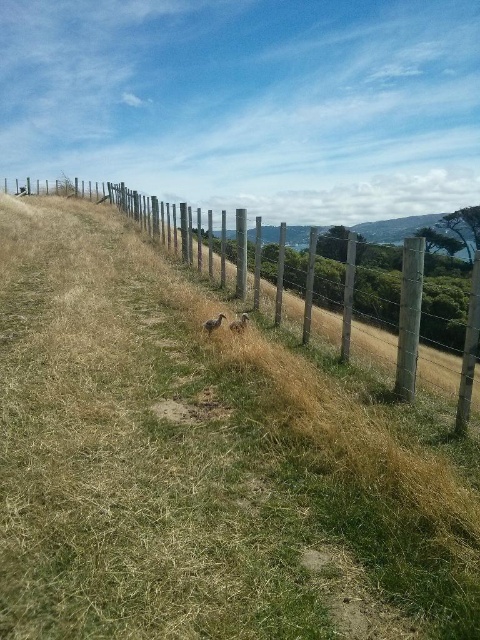
Is brown fuzzy bird at center to the left of brown fuzzy rabbit at center from the viewer's perspective?

No, brown fuzzy bird at center is not to the left of brown fuzzy rabbit at center.

Who is more distant from viewer, (236, 332) or (220, 317)?

The point (220, 317) is more distant.

This screenshot has width=480, height=640. I want to click on brown fuzzy bird at center, so click(240, 323).

Is wooden post fence at center to the left of brown fuzzy rabbit at center from the viewer's perspective?

No, wooden post fence at center is not to the left of brown fuzzy rabbit at center.

Between wooden post fence at center and brown fuzzy rabbit at center, which one appears on the left side from the viewer's perspective?

brown fuzzy rabbit at center

What do you see at coordinates (408, 348) in the screenshot?
I see `wooden post fence at center` at bounding box center [408, 348].

The width and height of the screenshot is (480, 640). Identify the location of wooden post fence at center. (408, 348).

Does wooden post fence at center have a lesser height compared to brown fuzzy bird at center?

Incorrect, wooden post fence at center's height does not fall short of brown fuzzy bird at center's.

Between point (478, 372) and point (241, 332), which one is positioned in front?

Point (478, 372)

Does point (403, 349) come closer to viewer compared to point (241, 317)?

That is True.

This screenshot has width=480, height=640. Find the location of `wooden post fence at center`. wooden post fence at center is located at coordinates (408, 348).